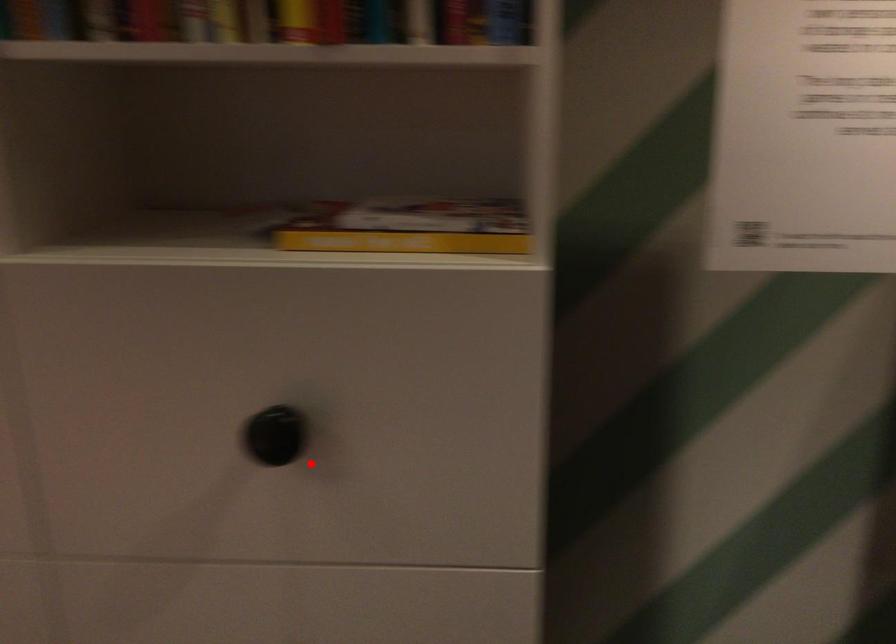
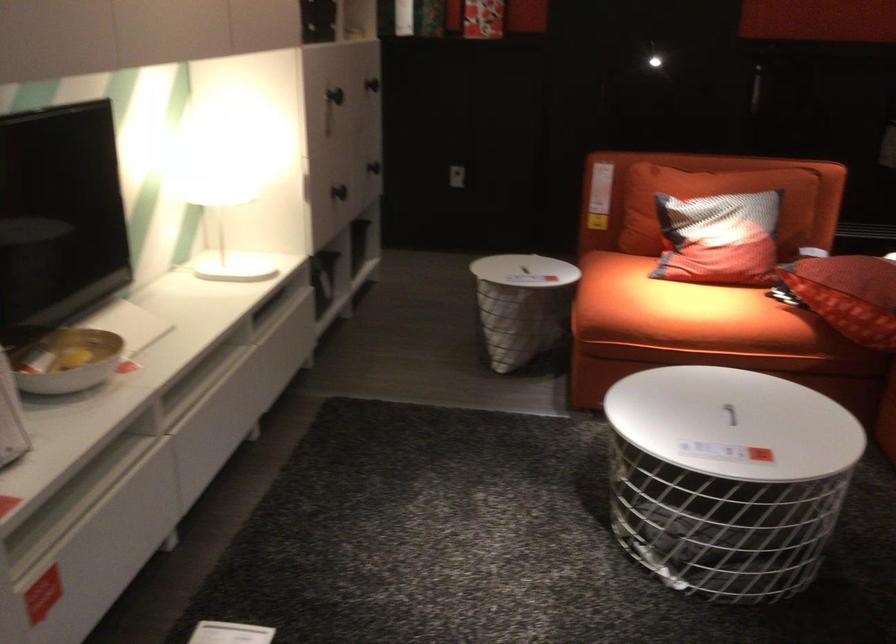
Where in the second image is the point corresponding to the highlighted location from the first image?

(372, 84)